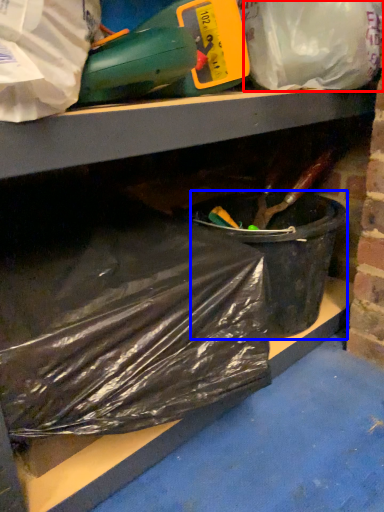
Question: Which object is further to the camera taking this photo, plastic bag (highlighted by a red box) or recycling bin (highlighted by a blue box)?

Choices:
 (A) plastic bag
 (B) recycling bin

Answer: (B)